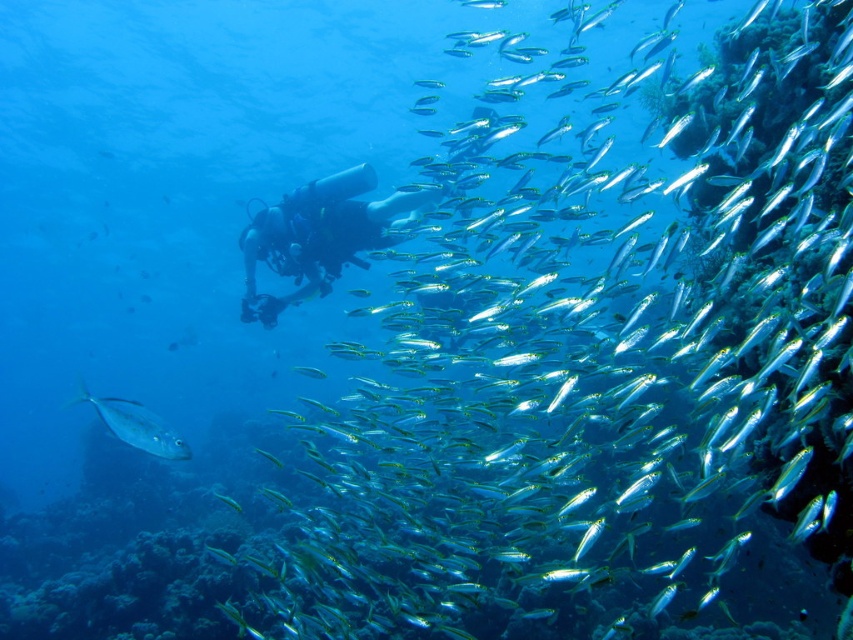
Question: Which point is farther from the camera taking this photo?

Choices:
 (A) (107, 404)
 (B) (328, 248)

Answer: (B)

Question: Is black matte scuba diver at center smaller than shiny silver fish at lower left?

Choices:
 (A) yes
 (B) no

Answer: (B)

Question: Does black matte scuba diver at center appear on the left side of shiny silver fish at lower left?

Choices:
 (A) no
 (B) yes

Answer: (A)

Question: Can you confirm if black matte scuba diver at center is positioned to the right of shiny silver fish at lower left?

Choices:
 (A) no
 (B) yes

Answer: (B)